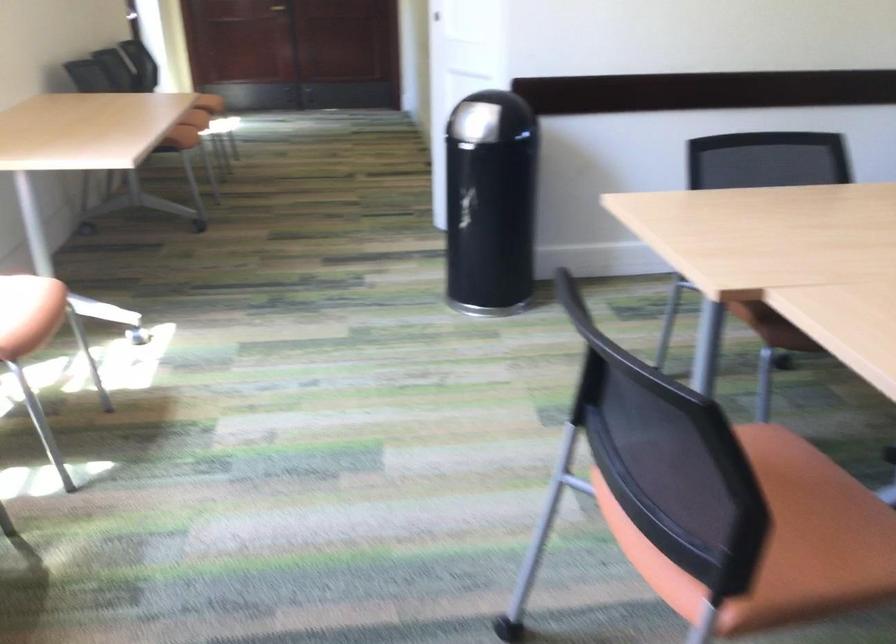
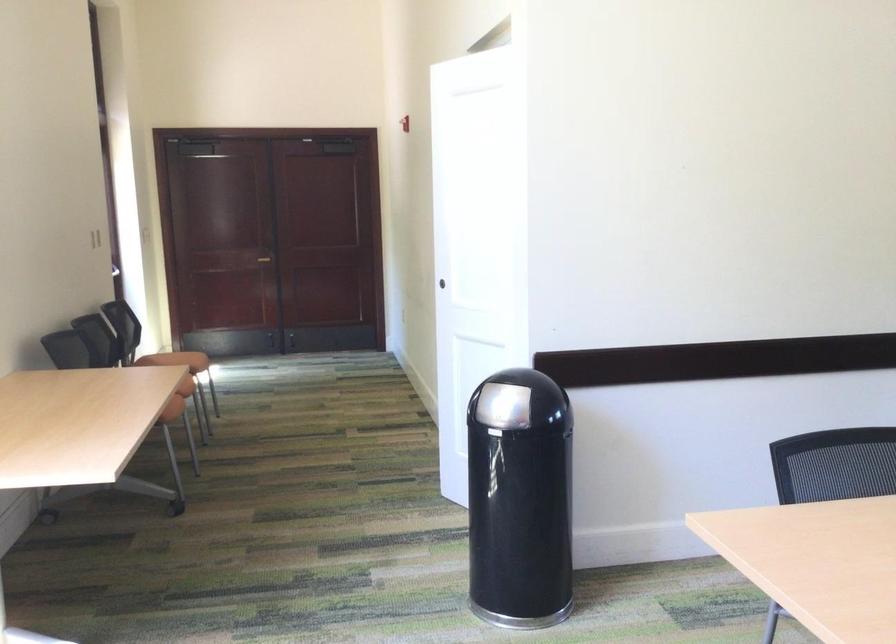
Looking at this image, which direction would the cameraman need to move to produce the second image?

The cameraman moved toward left, forward.